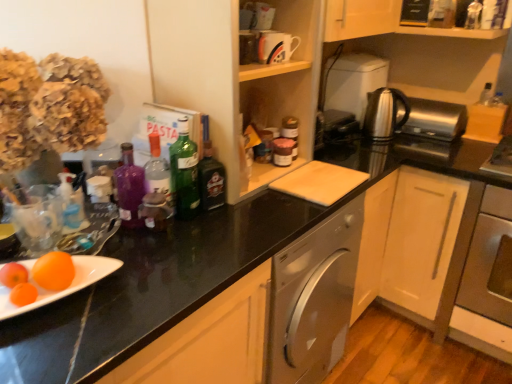
The image size is (512, 384). What do you see at coordinates (384, 113) in the screenshot? I see `silver metallic kettle at right` at bounding box center [384, 113].

In order to face satin silver kettle at upper right, the third appliance in the front-to-back sequence, should I rotate leftwards or rightwards?

To align with it, rotate right about 13.863°.

What do you see at coordinates (352, 82) in the screenshot? I see `satin silver kettle at upper right, marked as the 2th appliance in a left-to-right arrangement` at bounding box center [352, 82].

This screenshot has height=384, width=512. Describe the element at coordinates (13, 275) in the screenshot. I see `orange matte at lower left` at that location.

Locate an element on the screen. The width and height of the screenshot is (512, 384). satin silver toaster at upper right, which appears as the 1th appliance when viewed from the right is located at coordinates (433, 119).

At what (x,y) coordinates should I click in order to perform the action: click on silver metallic kettle at right. Please return your answer as a coordinate pair (x, y). The image size is (512, 384). Looking at the image, I should click on (384, 113).

From a real-world perspective, does green glass bottle at center, which ranks as the 2th bottle in right-to-left order, stand above purple glass bottle at center, which is the 4th bottle in right-to-left order?

Yes, from a real-world perspective, green glass bottle at center, which ranks as the 2th bottle in right-to-left order, is over purple glass bottle at center, which is the 4th bottle in right-to-left order

Does green glass bottle at center, which is the 3th bottle in left-to-right order, come behind purple glass bottle at center, which is the 4th bottle in right-to-left order?

Yes, it is.

In the scene shown: Is green glass bottle at center, which is the 3th bottle in left-to-right order, taller or shorter than purple glass bottle at center, which is the 4th bottle in right-to-left order?

green glass bottle at center, which is the 3th bottle in left-to-right order, is taller than purple glass bottle at center, which is the 4th bottle in right-to-left order.

From a real-world perspective, is green glass bottle at center, which is the 3th bottle in left-to-right order, above or below wooden cabinet at upper center?

In terms of real-world spatial position, green glass bottle at center, which is the 3th bottle in left-to-right order, is below wooden cabinet at upper center.

Would you say green glass bottle at center, which is the 3th bottle in left-to-right order, is outside wooden cabinet at upper center?

green glass bottle at center, which is the 3th bottle in left-to-right order, is positioned outside wooden cabinet at upper center.

In terms of width, does green glass bottle at center, which ranks as the 2th bottle in right-to-left order, look wider or thinner when compared to wooden cabinet at upper center?

green glass bottle at center, which ranks as the 2th bottle in right-to-left order, is thinner than wooden cabinet at upper center.

Are green glass bottle at center, which is the 3th bottle in left-to-right order, and wooden cabinet at upper center located far from each other?

That's not correct — green glass bottle at center, which is the 3th bottle in left-to-right order, is a little close to wooden cabinet at upper center.

Which object is wider, purple glass bottle at center, which is the 4th bottle in right-to-left order, or stainless steel oven at lower right?

Wider between the two is stainless steel oven at lower right.

Is purple glass bottle at center, which is the 4th bottle in right-to-left order, completely or partially outside of stainless steel oven at lower right?

That's correct, purple glass bottle at center, which is the 4th bottle in right-to-left order, is outside of stainless steel oven at lower right.

Based on the photo, in terms of size, does purple glass bottle at center, the first bottle positioned from the left, appear bigger or smaller than stainless steel oven at lower right?

Considering their sizes, purple glass bottle at center, the first bottle positioned from the left, takes up less space than stainless steel oven at lower right.

Are purple glass bottle at center, which is the 4th bottle in right-to-left order, and stainless steel oven at lower right making contact?

No.

From the image's perspective, between stainless steel oven at lower right and orange matte at lower left, which one is located above?

orange matte at lower left.

How different are the orientations of stainless steel oven at lower right and orange matte at lower left in degrees?

There is a 62-degree angle between the facing directions of stainless steel oven at lower right and orange matte at lower left.

Considering the sizes of stainless steel oven at lower right and orange matte at lower left in the image, is stainless steel oven at lower right wider or thinner than orange matte at lower left?

stainless steel oven at lower right is wider than orange matte at lower left.

From a real-world perspective, which object stands above the other?

orange matte at lower left, from a real-world perspective.

From the image's perspective, is orange matte at lower left located above wooden cabinet at upper center?

Actually, orange matte at lower left appears below wooden cabinet at upper center in the image.

Is orange matte at lower left looking in the opposite direction of wooden cabinet at upper center?

No, orange matte at lower left's orientation is not away from wooden cabinet at upper center.

Does orange matte at lower left have a larger size compared to wooden cabinet at upper center?

No, orange matte at lower left is not bigger than wooden cabinet at upper center.

At what (x,y) coordinates should I click in order to perform the action: click on fruit in front of the wooden cabinet at upper center. Please return your answer as a coordinate pair (x, y). The height and width of the screenshot is (384, 512). Looking at the image, I should click on pyautogui.click(x=13, y=275).

Does wooden cabinet at upper center have a lesser height compared to glossy ceramic mug at upper center, marked as the 1th appliance in a front-to-back arrangement?

Incorrect, the height of wooden cabinet at upper center does not fall short of that of glossy ceramic mug at upper center, marked as the 1th appliance in a front-to-back arrangement.

How far apart are wooden cabinet at upper center and glossy ceramic mug at upper center, the first appliance from the left?

23.25 centimeters.

Is wooden cabinet at upper center touching glossy ceramic mug at upper center, positioned as the third appliance in back-to-front order?

No, wooden cabinet at upper center is not touching glossy ceramic mug at upper center, positioned as the third appliance in back-to-front order.

Which of these two, purple glass bottle at center, which is the 4th bottle in right-to-left order, or wooden cabinet at upper center, is smaller?

With smaller size is purple glass bottle at center, which is the 4th bottle in right-to-left order.

Is purple glass bottle at center, which is the 4th bottle in right-to-left order, oriented away from wooden cabinet at upper center?

No, purple glass bottle at center, which is the 4th bottle in right-to-left order, is not facing away from wooden cabinet at upper center.

Which is closer to the camera, (123, 219) or (297, 4)?

Point (123, 219) appears to be closer to the viewer than point (297, 4).

Could you measure the distance between purple glass bottle at center, the first bottle positioned from the left, and wooden cabinet at upper center?

The distance of purple glass bottle at center, the first bottle positioned from the left, from wooden cabinet at upper center is 45.31 centimeters.

Which bottle is the 2nd one when counting from the left side of the green glass bottle at center, which ranks as the 2th bottle in right-to-left order? Please provide its 2D coordinates.

[(129, 188)]

The height and width of the screenshot is (384, 512). I want to click on bottle that is the 1st one when counting downward from the wooden cabinet at upper center (from the image's perspective), so (x=184, y=173).

When comparing their distances from satin silver kettle at upper right, marked as the 2th appliance in a left-to-right arrangement, does orange matte at lower left or glossy ceramic mug at upper center, positioned as the third appliance in back-to-front order, seem further?

orange matte at lower left is positioned further to the anchor satin silver kettle at upper right, marked as the 2th appliance in a left-to-right arrangement.

Estimate the real-world distances between objects in this image. Which object is closer to green glass bottle at center, which is the 3th bottle in left-to-right order, orange matte at lower left or stainless steel oven at lower right?

orange matte at lower left is closer to green glass bottle at center, which is the 3th bottle in left-to-right order.

Consider the image. Based on their spatial positions, is wooden cabinet at upper center or stainless steel oven at lower right closer to purple glass bottle at center, which is the 4th bottle in right-to-left order?

Based on the image, wooden cabinet at upper center appears to be nearer to purple glass bottle at center, which is the 4th bottle in right-to-left order.

When comparing their distances from satin silver kettle at upper right, the first appliance in the back-to-front sequence, does satin silver toaster at upper right, which appears as the 1th appliance when viewed from the right, or green glass bottle at center, which ranks as the 2th bottle in right-to-left order, seem closer?

satin silver toaster at upper right, which appears as the 1th appliance when viewed from the right, is positioned closer to the anchor satin silver kettle at upper right, the first appliance in the back-to-front sequence.

Considering their positions, is silver metallic kettle at right positioned closer to satin silver kettle at upper right, the second appliance when ordered from right to left, than stainless steel oven at lower right?

Among the two, silver metallic kettle at right is located nearer to satin silver kettle at upper right, the second appliance when ordered from right to left.

Which object lies nearer to the anchor point green glass bottle at center, which ranks as the 2th bottle in right-to-left order, orange matte at lower left or dark green glass bottle at center, arranged as the 1th bottle when viewed from the right?

dark green glass bottle at center, arranged as the 1th bottle when viewed from the right, lies closer to green glass bottle at center, which ranks as the 2th bottle in right-to-left order, than the other object.

From the picture: Looking at the image, which one is located further to dark green glass bottle at center, arranged as the 1th bottle when viewed from the right, orange matte at lower left or purple glass bottle at center, the first bottle positioned from the left?

orange matte at lower left lies further to dark green glass bottle at center, arranged as the 1th bottle when viewed from the right, than the other object.

Looking at the image, which one is located further to green glass bottle at center, which ranks as the 2th bottle in right-to-left order, dark green glass bottle at center, acting as the 4th bottle starting from the left, or translucent plastic bottle at center, which ranks as the 2th bottle in left-to-right order?

translucent plastic bottle at center, which ranks as the 2th bottle in left-to-right order, is positioned further to the anchor green glass bottle at center, which ranks as the 2th bottle in right-to-left order.

In order to click on appliance between silver metallic kettle at right and stainless steel oven at lower right vertically in this screenshot , I will do `click(433, 119)`.

At what (x,y) coordinates should I click in order to perform the action: click on kitchen appliance between wooden cabinet at upper center and satin silver kettle at upper right, the third appliance in the front-to-back sequence, in the front-back direction. Please return your answer as a coordinate pair (x, y). Looking at the image, I should click on (384, 113).

Locate an element on the screen. cabinetry situated between translucent plastic bottle at center, which ranks as the 2th bottle in left-to-right order, and silver metallic kettle at right from left to right is located at coordinates (236, 76).

I want to click on kitchen appliance between satin silver kettle at upper right, the second appliance when ordered from right to left, and satin silver toaster at upper right, which is the 3th appliance from left to right, so click(384, 113).